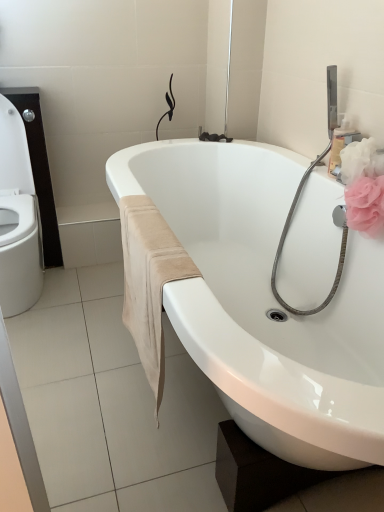
Locate an element on the screen. The image size is (384, 512). vacant area on top of beige suede towel at lower center (from a real-world perspective) is located at coordinates (153, 233).